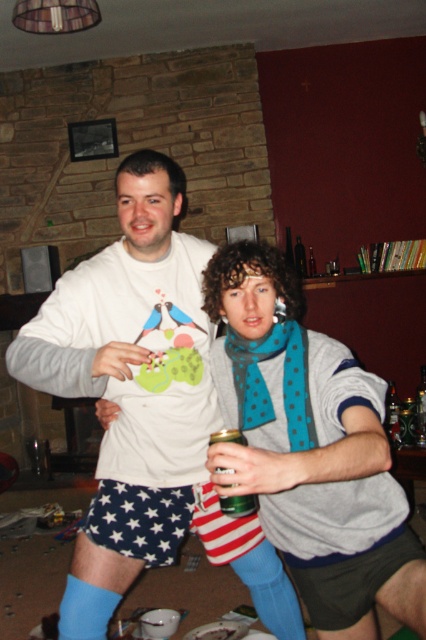
Is white matte sweatshirt at center to the right of green glass can at center from the viewer's perspective?

No, white matte sweatshirt at center is not to the right of green glass can at center.

What do you see at coordinates (131, 385) in the screenshot?
I see `white matte sweatshirt at center` at bounding box center [131, 385].

This screenshot has height=640, width=426. In order to click on white matte sweatshirt at center in this screenshot , I will do `click(131, 385)`.

Which is behind, point (235, 349) or point (233, 515)?

Point (235, 349)

Is teal dotted scarf at center taller than green glass can at center?

Correct, teal dotted scarf at center is much taller as green glass can at center.

Identify the location of teal dotted scarf at center. (265, 385).

The image size is (426, 640). Find the location of `teal dotted scarf at center`. teal dotted scarf at center is located at coordinates (265, 385).

Can you confirm if white matte sweatshirt at center is smaller than teal dotted scarf at center?

No, white matte sweatshirt at center is not smaller than teal dotted scarf at center.

Is point (199, 372) closer to camera compared to point (293, 336)?

No.

In order to click on white matte sweatshirt at center in this screenshot , I will do `click(131, 385)`.